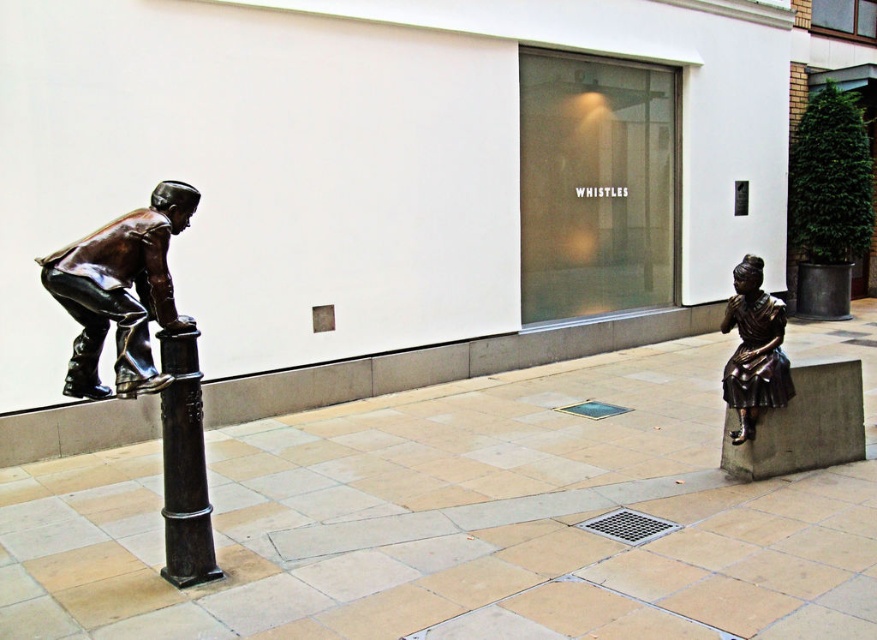
Describe the element at coordinates (184, 465) in the screenshot. This screenshot has height=640, width=877. I see `bronze textured pole at left` at that location.

Who is shorter, bronze textured pole at left or bronze statue at lower right?

Standing shorter between the two is bronze statue at lower right.

Does point (211, 563) come behind point (732, 371)?

No, (211, 563) is closer to viewer.

This screenshot has height=640, width=877. Find the location of `bronze textured pole at left`. bronze textured pole at left is located at coordinates (184, 465).

Can you confirm if bronze statue at left is positioned to the left of bronze statue at lower right?

Yes, bronze statue at left is to the left of bronze statue at lower right.

Is bronze statue at left thinner than bronze statue at lower right?

No.

Does point (165, 195) lie behind point (726, 371)?

No, (165, 195) is closer to viewer.

Identify the location of bronze statue at left. The image size is (877, 640). (120, 291).

Does bronze statue at left appear on the left side of bronze textured pole at left?

Correct, you'll find bronze statue at left to the left of bronze textured pole at left.

Describe the element at coordinates (120, 291) in the screenshot. The width and height of the screenshot is (877, 640). I see `bronze statue at left` at that location.

Is point (83, 307) positioned before point (183, 474)?

Yes, point (83, 307) is in front of point (183, 474).

Image resolution: width=877 pixels, height=640 pixels. Find the location of `bronze statue at left`. bronze statue at left is located at coordinates (120, 291).